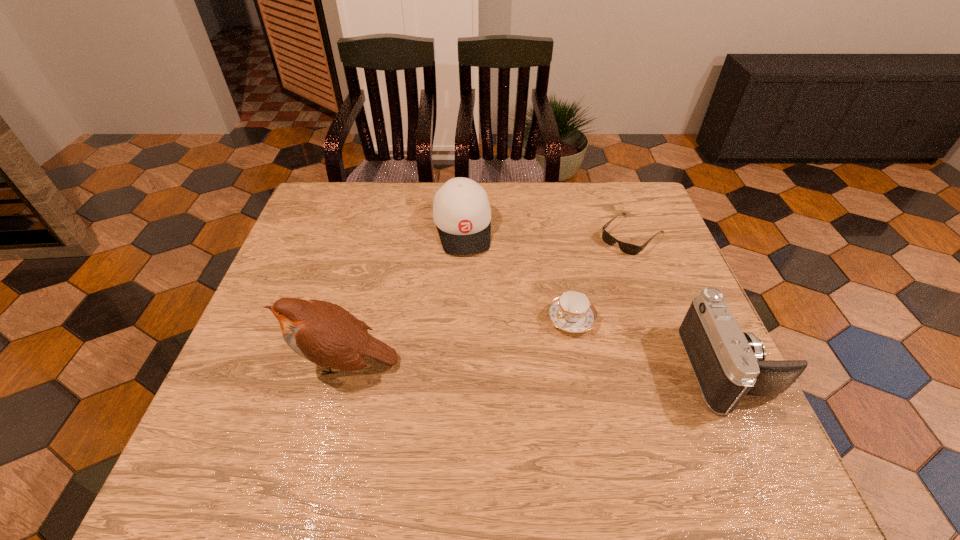
Locate an element on the screen. vacant space on the desktop that is between the tallest object and the camera and is positioned on the front-facing side of the shortest object is located at coordinates (487, 365).

Image resolution: width=960 pixels, height=540 pixels. Identify the location of vacant space on the desktop that is between the bird and the camera and is positioned on the front-facing side of the third tallest object. (487, 365).

You are a GUI agent. You are given a task and a screenshot of the screen. Output one action in this format:
    pyautogui.click(x=<x>, y=<y>)
    Task: Click on the free spot on the desktop that is between the bird and the camera and is positioned on the side with the handle of the teacup
    The height and width of the screenshot is (540, 960).
    Given the screenshot: What is the action you would take?
    pyautogui.click(x=505, y=365)